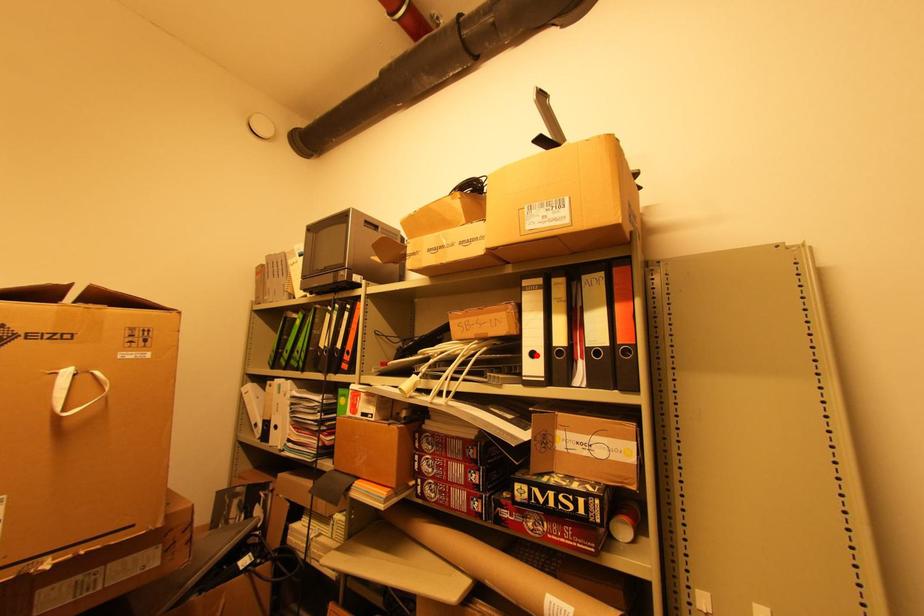
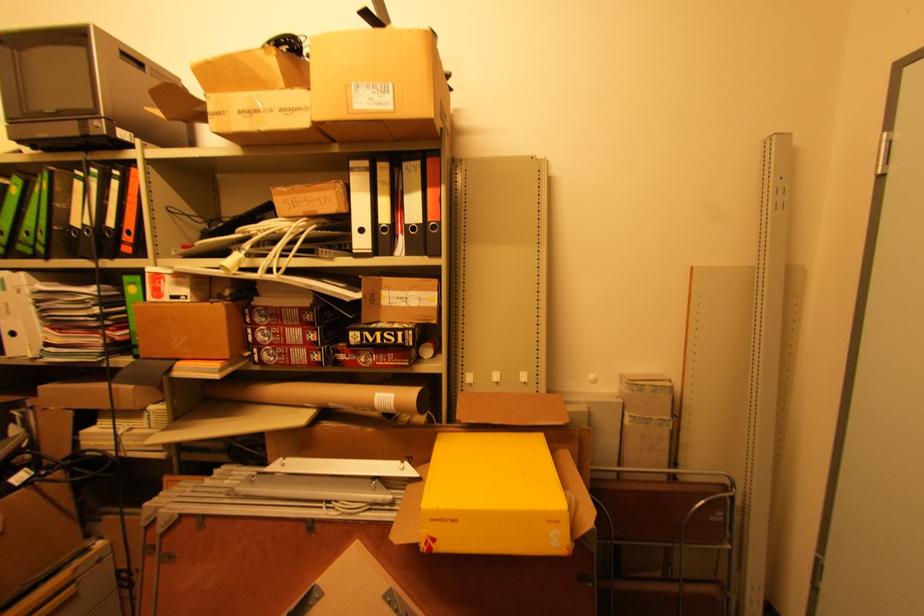
Question: I am providing you with two images of the same scene from different viewpoints. A red point is marked on the first image. Can you still see the location of the red point in image 2?

Choices:
 (A) Yes
 (B) No

Answer: (A)